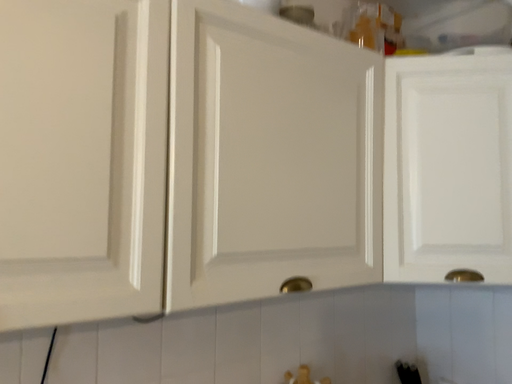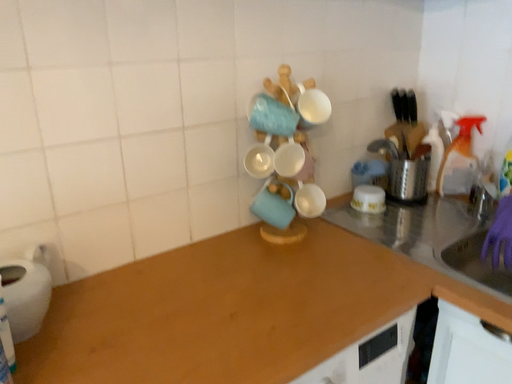
Question: Which way did the camera rotate in the video?

Choices:
 (A) rotated upward
 (B) rotated downward

Answer: (B)